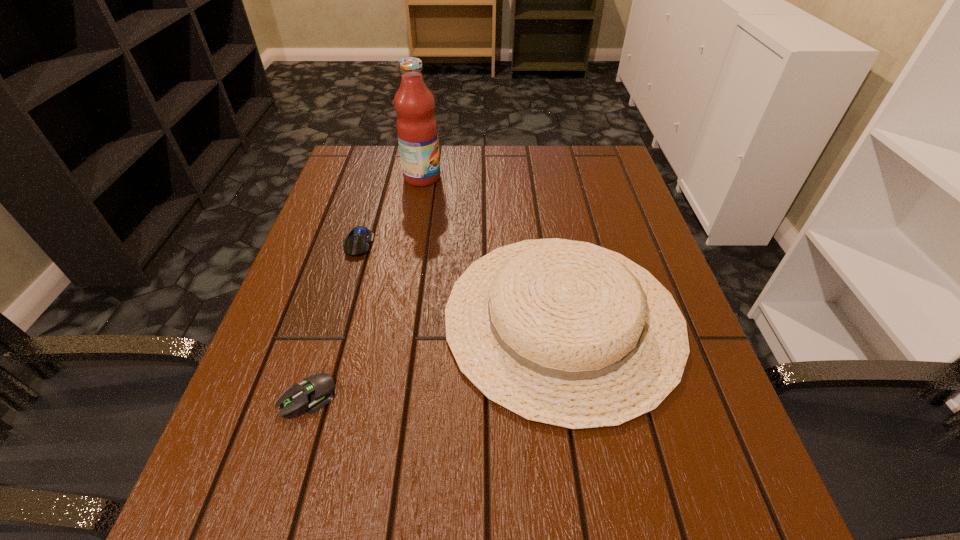
Locate an element on the screen. The image size is (960, 540). free space between the rightmost object and the tallest object is located at coordinates (492, 248).

Where is `free spot between the third shortest object and the farthest object`? free spot between the third shortest object and the farthest object is located at coordinates (492, 248).

In order to click on free space between the nearer computer mouse and the tallest object in this screenshot , I will do `click(365, 287)`.

The image size is (960, 540). Identify the location of free space between the nearer computer mouse and the farthest object. (365, 287).

Where is `free space between the tallest object and the sunhat`? This screenshot has width=960, height=540. free space between the tallest object and the sunhat is located at coordinates (492, 248).

You are a GUI agent. You are given a task and a screenshot of the screen. Output one action in this format:
    pyautogui.click(x=<x>, y=<y>)
    Task: Click on the free space between the nearer computer mouse and the farther computer mouse
    The image size is (960, 540).
    Given the screenshot: What is the action you would take?
    pyautogui.click(x=333, y=320)

Find the location of a particular element. The width and height of the screenshot is (960, 540). vacant region between the second object from right to left and the farther computer mouse is located at coordinates (390, 211).

The image size is (960, 540). Find the location of `empty space between the farther computer mouse and the second object from right to left`. empty space between the farther computer mouse and the second object from right to left is located at coordinates (390, 211).

Locate which object is the closest to the nearer computer mouse. Please provide its 2D coordinates. Your answer should be formatted as a tuple, i.e. [(x, y)], where the tuple contains the x and y coordinates of a point satisfying the conditions above.

[(565, 333)]

At what (x,y) coordinates should I click in order to perform the action: click on object that stands as the second closest to the nearer computer mouse. Please return your answer as a coordinate pair (x, y). The width and height of the screenshot is (960, 540). Looking at the image, I should click on (357, 242).